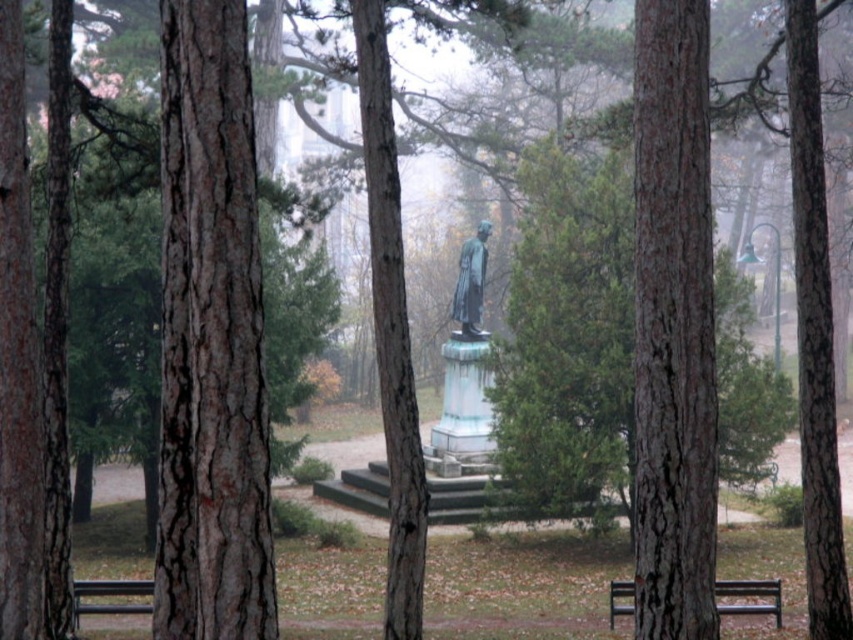
Can you confirm if bronze statue at center is taller than black wooden bench at center?

Indeed, bronze statue at center has a greater height compared to black wooden bench at center.

Is bronze statue at center wider than black wooden bench at center?

Yes, bronze statue at center is wider than black wooden bench at center.

Which is behind, point (457, 310) or point (780, 588)?

Point (457, 310)

The image size is (853, 640). In order to click on bronze statue at center in this screenshot , I will do `click(471, 282)`.

This screenshot has width=853, height=640. What are the coordinates of `smooth brown bark at center` in the screenshot? It's located at (672, 324).

Does smooth brown bark at center have a lesser height compared to bronze statue at center?

Incorrect, smooth brown bark at center's height does not fall short of bronze statue at center's.

In order to click on smooth brown bark at center in this screenshot , I will do `click(672, 324)`.

Between brown rough bark tree trunk at left and smooth brown bark at center, which one appears on the right side from the viewer's perspective?

smooth brown bark at center

Which of these two, brown rough bark tree trunk at left or smooth brown bark at center, stands shorter?

brown rough bark tree trunk at left

Does point (247, 209) come closer to viewer compared to point (683, 118)?

Yes, it is in front of point (683, 118).

This screenshot has width=853, height=640. I want to click on brown rough bark tree trunk at left, so click(210, 339).